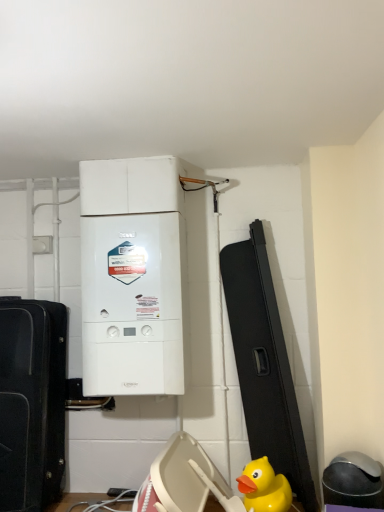
Question: Is black matte suitcase at left inside the boundaries of white matte boiler at center, or outside?

Choices:
 (A) inside
 (B) outside

Answer: (B)

Question: Is black matte suitcase at left to the left or to the right of white matte boiler at center in the image?

Choices:
 (A) left
 (B) right

Answer: (A)

Question: Which is farther from the black matte suitcase at left?

Choices:
 (A) yellow rubber duck at lower right
 (B) white matte boiler at center

Answer: (A)

Question: Which object is the farthest from the white matte boiler at center?

Choices:
 (A) black matte suitcase at left
 (B) yellow rubber duck at lower right

Answer: (B)